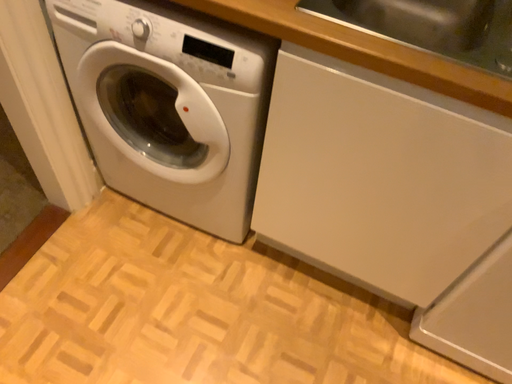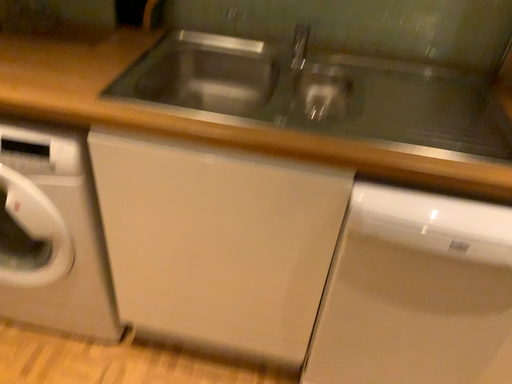
Question: How did the camera likely rotate when shooting the video?

Choices:
 (A) rotated left
 (B) rotated right

Answer: (B)